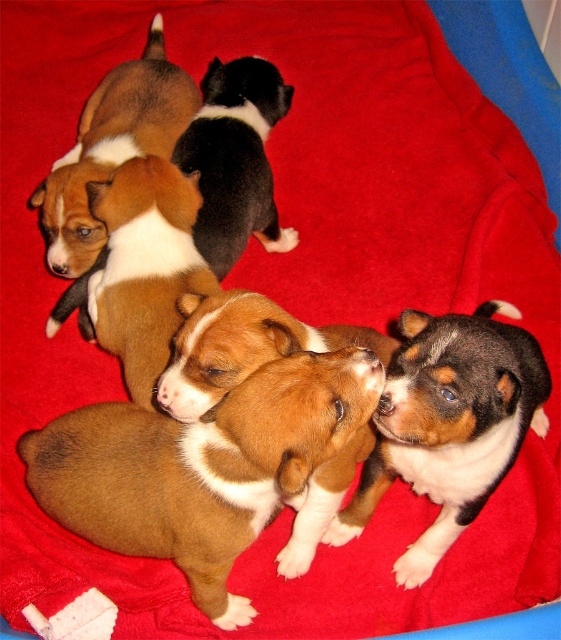
Question: Does brown and white fur at center have a greater width compared to black and white fur at center?

Choices:
 (A) no
 (B) yes

Answer: (B)

Question: Which of the following is the closest to the observer?

Choices:
 (A) (344, 426)
 (B) (461, 426)
 (C) (107, 74)

Answer: (A)

Question: Which of these objects is positioned closest to the brown fur puppy at upper left?

Choices:
 (A) brown/white fur puppy at center
 (B) brown and white fur at center

Answer: (A)

Question: Which point is farther to the camera?

Choices:
 (A) (241, 157)
 (B) (220, 547)
 (C) (84, 108)

Answer: (C)

Question: Is brown and white fur at center below black and white fur at center?

Choices:
 (A) no
 (B) yes

Answer: (B)

Question: Is brown/white fur puppy at center positioned behind black and white fur at center?

Choices:
 (A) yes
 (B) no

Answer: (B)